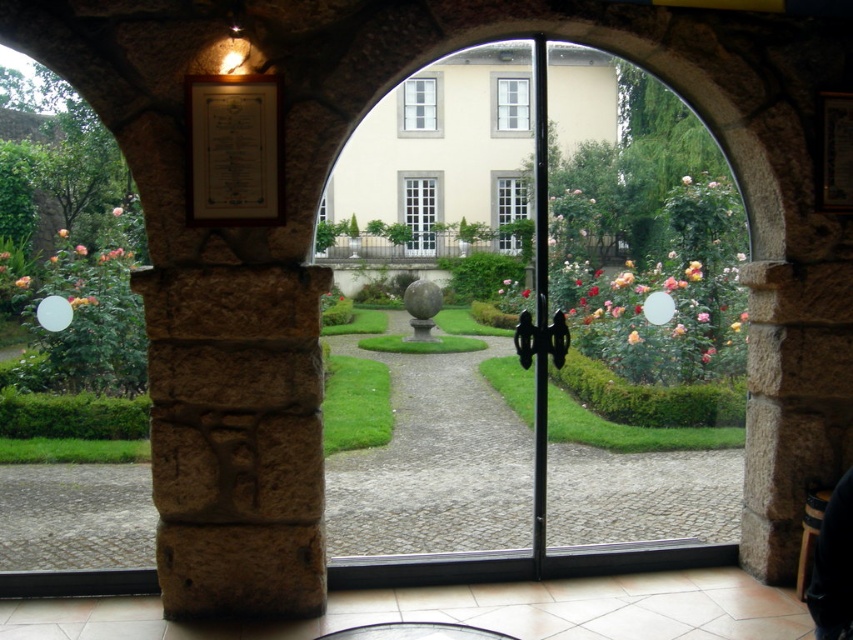
You are standing in a room with a clear glass door at center and a white tile floor at center. Which object is taller?

The clear glass door at center is much taller than the white tile floor at center.

You are standing in the garden and want to walk from the arched doorway to the fountain. There are two points marked on your map, point [426,348] and point [795,616]. Which point is closer to you as you start your journey?

Point [426,348] is closer to you because it is further to the viewer than point [795,616], meaning it is nearer to your starting position at the doorway.

You are standing in the garden and want to walk towards the clear glass door at center. Which direction should you move relative to the white tile floor at center?

You should move towards the clear glass door at center, which is closer to you than the white tile floor at center, so you need to walk forward towards it.